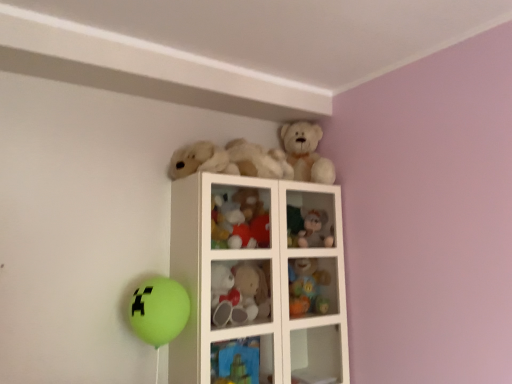
Question: Considering the relative positions of white glass cabinet at upper center and fuzzy fabric teddy bear at upper center, the second cabinet in the bottom-to-top sequence, in the image provided, is white glass cabinet at upper center to the left or to the right of fuzzy fabric teddy bear at upper center, the second cabinet in the bottom-to-top sequence,?

Choices:
 (A) left
 (B) right

Answer: (A)

Question: Considering their positions, is white glass cabinet at upper center located in front of or behind fuzzy fabric teddy bear at upper center, positioned as the 2th cabinet in front-to-back order?

Choices:
 (A) behind
 (B) front

Answer: (B)

Question: Which object is positioned farthest from the green matte balloon at lower left?

Choices:
 (A) fluffy plush toys at upper center, placed as the third toy when sorted from top to bottom
 (B) white plush bear at upper center, the first toy viewed from the top
 (C) white glass cabinet at upper center
 (D) fluffy beige teddy bear at upper center, arranged as the second toy when ordered from the bottom
 (E) plush toy at upper right, marked as the 1th toy in a bottom-to-top arrangement

Answer: (B)

Question: Which object is positioned closest to the fluffy beige teddy bear at upper center, the 4th toy in the top-to-bottom sequence?

Choices:
 (A) fuzzy fabric teddy bear at upper center, which is the second cabinet in left-to-right order
 (B) plush toy at upper right, marked as the 1th toy in a bottom-to-top arrangement
 (C) green matte balloon at lower left
 (D) white plush bear at upper center, the first toy viewed from the top
 (E) fluffy white teddy bear at upper center, the 2th toy in the top-to-bottom sequence

Answer: (B)